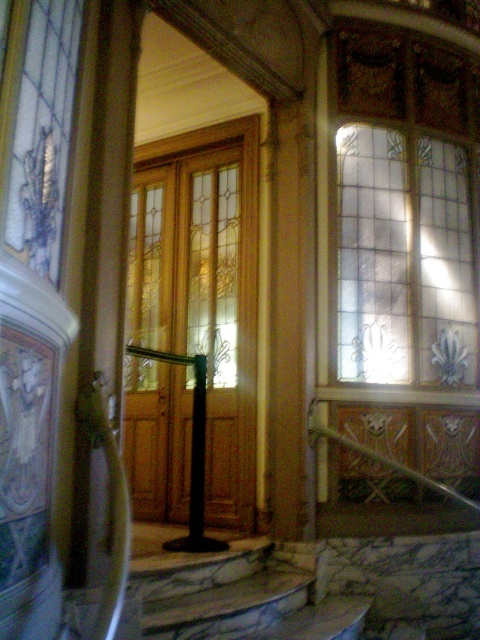
Consider the image. You are an interior designer planning to install a new decorative panel that matches the stained glass at upper right. The marble stairs at lower center has a width of 2 meters. What is the maximum width you can design for the new panel to ensure it doesn

The stained glass at upper right has a width less than the marble stairs at lower center, which is 2 meters. Therefore, the maximum width you can design for the new panel is just under 2 meters to ensure it matches the stained glass at upper right.

You are an interior designer assessing the space for a client who wants to install a floor lamp. The lamp is 2 meters tall. Given the translucent wood door at center and marble stairs at lower center, which object would the lamp be taller than?

The translucent wood door at center has a greater height compared to marble stairs at lower center. Since the lamp is 2 meters tall, it would be taller than both the translucent wood door at center and the marble stairs at lower center.

You are standing in the room and want to take a closer look at the stained glass at upper right. Given that the average adult walking distance is about 12 feet, can you reach it without moving any furniture?

The stained glass at upper right is 15.05 feet away from the camera, which is beyond the average adult walking distance of 12 feet. Therefore, you would need to move closer or adjust your position to reach it.